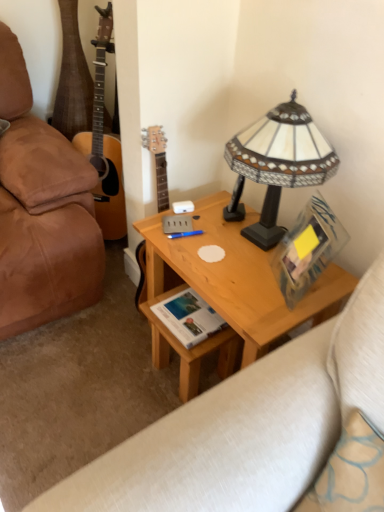
The image size is (384, 512). What are the coordinates of `free area in between stained glass lampshade at upper right and blue plastic pen at center` in the screenshot? It's located at (209, 242).